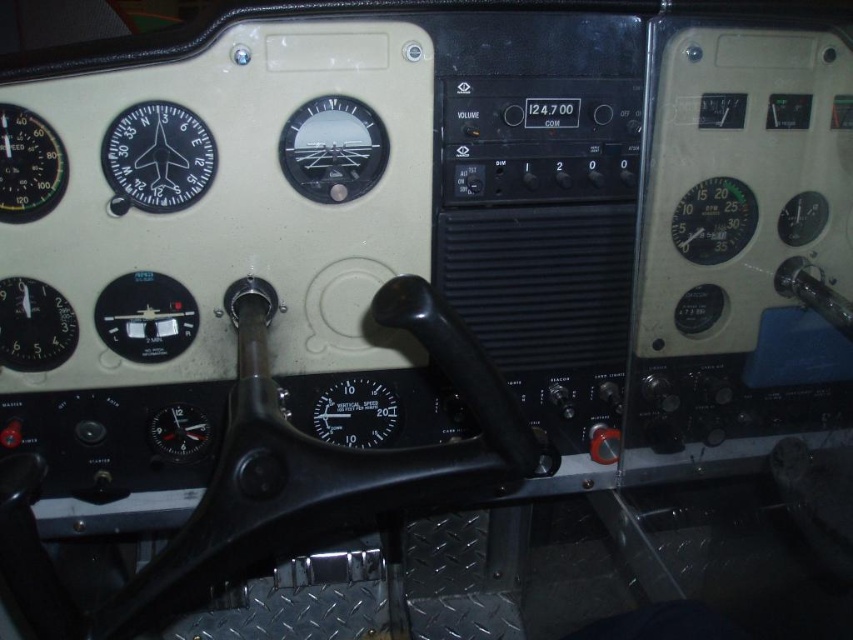
Question: Which object is the closest to the matte black gauge at upper left?

Choices:
 (A) matte black gauge at lower left
 (B) matte black gauge at center
 (C) black glass gauge at center
 (D) matte black gauge at center left

Answer: (A)

Question: Is matte black gauge at upper left smaller than black glass gauge at center?

Choices:
 (A) yes
 (B) no

Answer: (A)

Question: Which point is closer to the camera?

Choices:
 (A) matte black gauge at lower left
 (B) matte black gauge at center left
 (C) matte black compass at upper left

Answer: (C)

Question: Which object is farther from the camera taking this photo?

Choices:
 (A) matte black gauge at upper right
 (B) matte black gauge at center
 (C) black glass gauge at center
 (D) matte black gauge at center left

Answer: (C)

Question: From the image, what is the correct spatial relationship of matte black gauge at center in relation to green matte gauge at upper right?

Choices:
 (A) left
 (B) right

Answer: (A)

Question: Where is matte black gauge at upper left located in relation to green matte gauge at upper right in the image?

Choices:
 (A) left
 (B) right

Answer: (A)